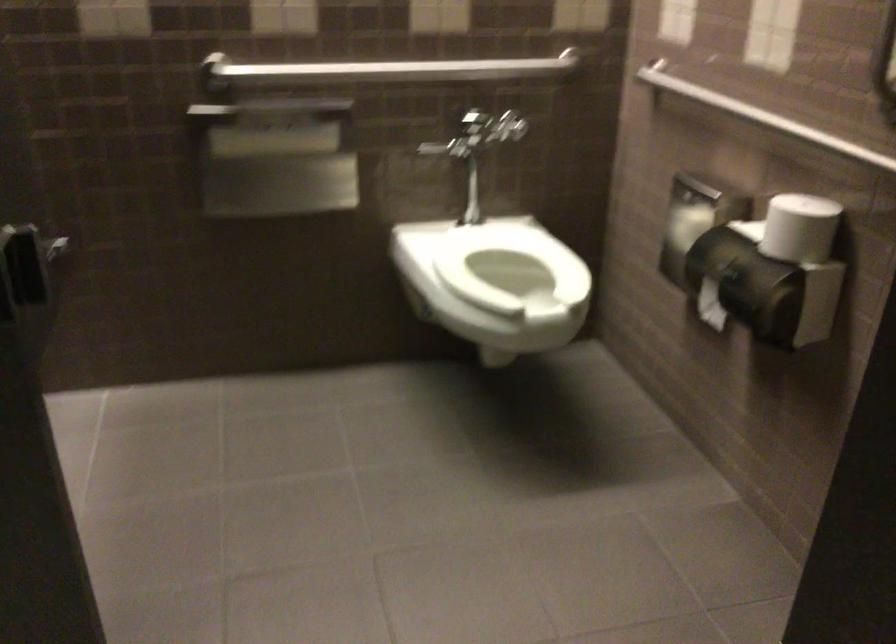
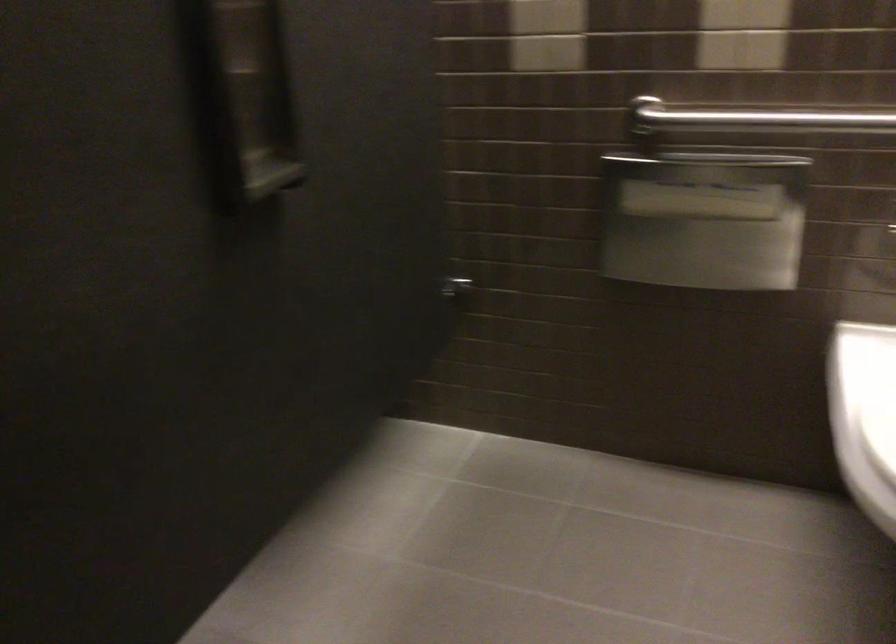
The point at (x=282, y=156) is marked in the first image. Where is the corresponding point in the second image?

(703, 220)